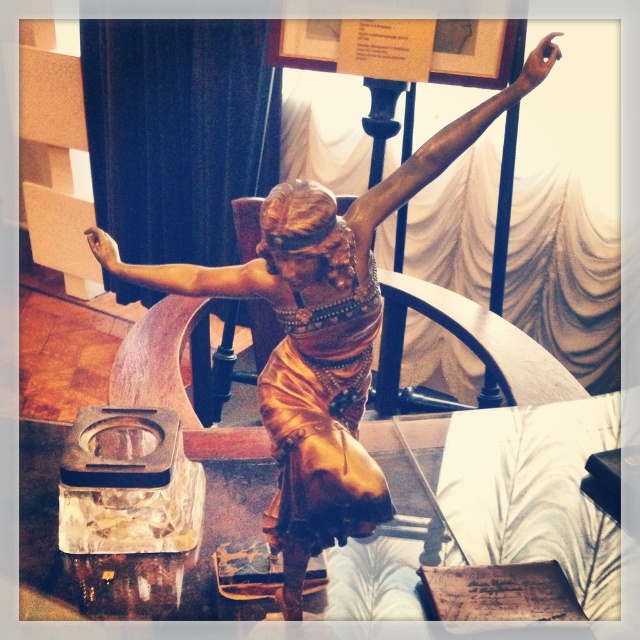
Question: Which of these objects is positioned farthest from the bronze statue arm at center?

Choices:
 (A) gold shiny statue at center
 (B) bronze arm at upper center

Answer: (B)

Question: Which point is farther to the camera?

Choices:
 (A) (432, 150)
 (B) (280, 209)

Answer: (A)

Question: Is gold shiny statue at center wider than bronze statue arm at center?

Choices:
 (A) no
 (B) yes

Answer: (B)

Question: Which point is farther to the camera?

Choices:
 (A) bronze statue arm at center
 (B) bronze arm at upper center
 (C) gold shiny statue at center

Answer: (A)

Question: Is gold shiny statue at center bigger than bronze statue arm at center?

Choices:
 (A) yes
 (B) no

Answer: (A)

Question: Is bronze arm at upper center positioned in front of bronze statue arm at center?

Choices:
 (A) yes
 (B) no

Answer: (A)